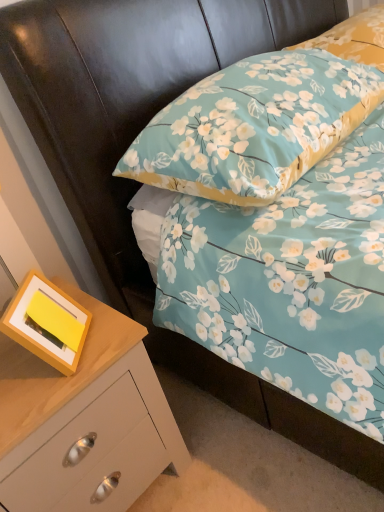
In order to click on yellow matte picture frame at lower left in this screenshot , I will do `click(39, 330)`.

What is the approximate width of floral fabric pillow at upper center, acting as the first pillow starting from the bottom?

floral fabric pillow at upper center, acting as the first pillow starting from the bottom, is 48.55 centimeters wide.

The width and height of the screenshot is (384, 512). Describe the element at coordinates (354, 38) in the screenshot. I see `floral fabric pillow at upper right, the first pillow positioned from the top` at that location.

You are a GUI agent. You are given a task and a screenshot of the screen. Output one action in this format:
    pyautogui.click(x=<x>, y=<y>)
    Task: Click on the yellow matte picture frame at lower left
    This screenshot has height=512, width=384.
    Given the screenshot: What is the action you would take?
    pyautogui.click(x=39, y=330)

Consider the image. Looking at the image, does wooden chest of drawers at lower left seem bigger or smaller compared to floral fabric pillow at upper center, marked as the second pillow in a top-to-bottom arrangement?

In the image, wooden chest of drawers at lower left appears to be larger than floral fabric pillow at upper center, marked as the second pillow in a top-to-bottom arrangement.

Can you tell me how much wooden chest of drawers at lower left and floral fabric pillow at upper center, acting as the first pillow starting from the bottom, differ in facing direction?

There is a 0.801-degree angle between the facing directions of wooden chest of drawers at lower left and floral fabric pillow at upper center, acting as the first pillow starting from the bottom.

In the image, there is a floral fabric pillow at upper center, marked as the second pillow in a top-to-bottom arrangement. At what (x,y) coordinates should I click in order to perform the action: click on the chest of drawers below it (from a real-world perspective). Please return your answer as a coordinate pair (x, y). This screenshot has width=384, height=512. Looking at the image, I should click on [85, 420].

Is wooden chest of drawers at lower left completely or partially outside of floral fabric pillow at upper center, acting as the first pillow starting from the bottom?

Yes.

Can you tell me how much yellow matte picture frame at lower left and floral fabric pillow at upper right, the first pillow positioned from the top, differ in facing direction?

There is a 41.3-degree angle between the facing directions of yellow matte picture frame at lower left and floral fabric pillow at upper right, the first pillow positioned from the top.

Between yellow matte picture frame at lower left and floral fabric pillow at upper right, the second pillow positioned from the bottom, which one has smaller width?

With smaller width is yellow matte picture frame at lower left.

Who is bigger, yellow matte picture frame at lower left or floral fabric pillow at upper right, the second pillow positioned from the bottom?

Bigger between the two is floral fabric pillow at upper right, the second pillow positioned from the bottom.

From the picture: How far apart are yellow matte picture frame at lower left and floral fabric pillow at upper right, the first pillow positioned from the top?

yellow matte picture frame at lower left and floral fabric pillow at upper right, the first pillow positioned from the top, are 3.66 feet apart.

Between yellow matte picture frame at lower left and wooden chest of drawers at lower left, which one has smaller width?

Thinner between the two is yellow matte picture frame at lower left.

Choose the correct answer: Is yellow matte picture frame at lower left inside wooden chest of drawers at lower left or outside it?

yellow matte picture frame at lower left cannot be found inside wooden chest of drawers at lower left.

Is point (66, 298) positioned in front of point (173, 433)?

Yes, point (66, 298) is in front of point (173, 433).

From a real-world perspective, between yellow matte picture frame at lower left and wooden chest of drawers at lower left, who is vertically higher?

In real-world perspective, yellow matte picture frame at lower left is above.

Is floral fabric pillow at upper center, marked as the second pillow in a top-to-bottom arrangement, in contact with yellow matte picture frame at lower left?

No, floral fabric pillow at upper center, marked as the second pillow in a top-to-bottom arrangement, is not making contact with yellow matte picture frame at lower left.

What's the angular difference between floral fabric pillow at upper center, marked as the second pillow in a top-to-bottom arrangement, and yellow matte picture frame at lower left's facing directions?

floral fabric pillow at upper center, marked as the second pillow in a top-to-bottom arrangement, and yellow matte picture frame at lower left are facing 44.5 degrees away from each other.

Is floral fabric pillow at upper center, marked as the second pillow in a top-to-bottom arrangement, positioned behind yellow matte picture frame at lower left?

No, it is not.

Image resolution: width=384 pixels, height=512 pixels. In order to click on pillow in front of the yellow matte picture frame at lower left in this screenshot , I will do `click(253, 126)`.

From the image's perspective, is wooden chest of drawers at lower left over yellow matte picture frame at lower left?

No, from the image's perspective, wooden chest of drawers at lower left is not above yellow matte picture frame at lower left.

Consider the image. Is wooden chest of drawers at lower left facing towards yellow matte picture frame at lower left?

No, wooden chest of drawers at lower left is not facing towards yellow matte picture frame at lower left.

In the scene shown: Can you confirm if wooden chest of drawers at lower left is taller than yellow matte picture frame at lower left?

Yes, wooden chest of drawers at lower left is taller than yellow matte picture frame at lower left.

Between wooden chest of drawers at lower left and yellow matte picture frame at lower left, which one has smaller width?

yellow matte picture frame at lower left.

Locate an element on the screen. Image resolution: width=384 pixels, height=512 pixels. pillow that is the 2nd object located above the wooden chest of drawers at lower left (from the image's perspective) is located at coordinates click(354, 38).

Is point (369, 34) in front of point (118, 377)?

That is False.

Who is smaller, floral fabric pillow at upper right, the second pillow positioned from the bottom, or wooden chest of drawers at lower left?

With smaller size is floral fabric pillow at upper right, the second pillow positioned from the bottom.

Is wooden chest of drawers at lower left a part of floral fabric pillow at upper right, the second pillow positioned from the bottom?

No, wooden chest of drawers at lower left is not a part of floral fabric pillow at upper right, the second pillow positioned from the bottom.

Which of these two, floral fabric pillow at upper right, the second pillow positioned from the bottom, or yellow matte picture frame at lower left, stands taller?

yellow matte picture frame at lower left is taller.

In order to click on picture frame in front of the floral fabric pillow at upper right, the second pillow positioned from the bottom in this screenshot , I will do `click(39, 330)`.

Between floral fabric pillow at upper right, the first pillow positioned from the top, and yellow matte picture frame at lower left, which one is positioned behind?

Positioned behind is floral fabric pillow at upper right, the first pillow positioned from the top.

From the wooden chest of drawers at lower left, count 1st pillow to the right and point to it. Please provide its 2D coordinates.

[(253, 126)]

This screenshot has width=384, height=512. I want to click on picture frame below the floral fabric pillow at upper right, the first pillow positioned from the top (from a real-world perspective), so click(x=39, y=330).

Estimate the real-world distances between objects in this image. Which object is closer to yellow matte picture frame at lower left, wooden chest of drawers at lower left or floral fabric pillow at upper right, the second pillow positioned from the bottom?

wooden chest of drawers at lower left is closer to yellow matte picture frame at lower left.

Based on the photo, looking at the image, which one is located further to yellow matte picture frame at lower left, wooden chest of drawers at lower left or floral fabric pillow at upper center, marked as the second pillow in a top-to-bottom arrangement?

floral fabric pillow at upper center, marked as the second pillow in a top-to-bottom arrangement, is positioned further to the anchor yellow matte picture frame at lower left.

Estimate the real-world distances between objects in this image. Which object is further from yellow matte picture frame at lower left, floral fabric pillow at upper center, marked as the second pillow in a top-to-bottom arrangement, or wooden chest of drawers at lower left?

floral fabric pillow at upper center, marked as the second pillow in a top-to-bottom arrangement, lies further to yellow matte picture frame at lower left than the other object.

Estimate the real-world distances between objects in this image. Which object is further from wooden chest of drawers at lower left, floral fabric pillow at upper center, acting as the first pillow starting from the bottom, or floral fabric pillow at upper right, the first pillow positioned from the top?

floral fabric pillow at upper right, the first pillow positioned from the top, lies further to wooden chest of drawers at lower left than the other object.

When comparing their distances from yellow matte picture frame at lower left, does floral fabric pillow at upper right, the second pillow positioned from the bottom, or wooden chest of drawers at lower left seem closer?

Among the two, wooden chest of drawers at lower left is located nearer to yellow matte picture frame at lower left.

Estimate the real-world distances between objects in this image. Which object is further from wooden chest of drawers at lower left, floral fabric pillow at upper center, acting as the first pillow starting from the bottom, or yellow matte picture frame at lower left?

Among the two, floral fabric pillow at upper center, acting as the first pillow starting from the bottom, is located further to wooden chest of drawers at lower left.

Considering their positions, is floral fabric pillow at upper center, marked as the second pillow in a top-to-bottom arrangement, positioned closer to yellow matte picture frame at lower left than floral fabric pillow at upper right, the second pillow positioned from the bottom?

floral fabric pillow at upper center, marked as the second pillow in a top-to-bottom arrangement.

Considering their positions, is yellow matte picture frame at lower left positioned further to wooden chest of drawers at lower left than floral fabric pillow at upper right, the first pillow positioned from the top?

floral fabric pillow at upper right, the first pillow positioned from the top, is further to wooden chest of drawers at lower left.

Locate an element on the screen. The image size is (384, 512). picture frame between floral fabric pillow at upper center, marked as the second pillow in a top-to-bottom arrangement, and wooden chest of drawers at lower left vertically is located at coordinates (39, 330).

The width and height of the screenshot is (384, 512). Find the location of `pillow that lies between floral fabric pillow at upper right, the second pillow positioned from the bottom, and wooden chest of drawers at lower left from top to bottom`. pillow that lies between floral fabric pillow at upper right, the second pillow positioned from the bottom, and wooden chest of drawers at lower left from top to bottom is located at coordinates [x=253, y=126].

This screenshot has width=384, height=512. Identify the location of picture frame between floral fabric pillow at upper right, the first pillow positioned from the top, and wooden chest of drawers at lower left, in the vertical direction. (39, 330).

Locate an element on the screen. pillow between floral fabric pillow at upper right, the first pillow positioned from the top, and yellow matte picture frame at lower left in the up-down direction is located at coordinates (253, 126).